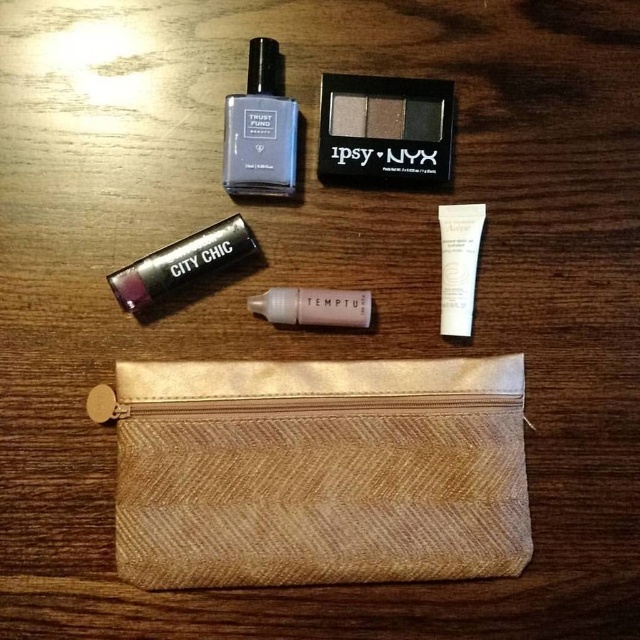
You are organizing a makeup kit and need to place the matte eyeshadow palette at upper center and the satin pink liquid at center into a compartment that is 8 inches wide. Will both items fit side by side without overlapping?

The distance between the matte eyeshadow palette at upper center and the satin pink liquid at center is 8.35 inches. Since the compartment is only 8 inches wide, the items will not fit side by side without overlapping.

From the picture: You are organizing beauty products on a shelf and need to place the satin black nail polish at upper center and the satin pink liquid at center. If the shelf has a width of 10 cm, can both items fit side by side?

The satin black nail polish at upper center has a lesser width compared to satin pink liquid at center. However, the combined width of both items is not specified, so it is uncertain if they can fit on a 10 cm shelf without knowing the exact dimensions of each item.

You are organizing a makeup kit and see the satin black nail polish at upper center and the satin pink liquid at center. Which one is closer to you?

The satin black nail polish at upper center is closer to you because it is in front of the satin pink liquid at center.